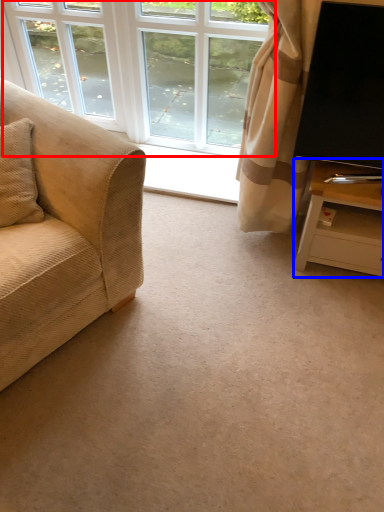
Question: Which of the following is the closest to the observer, window (highlighted by a red box) or table (highlighted by a blue box)?

Choices:
 (A) window
 (B) table

Answer: (B)